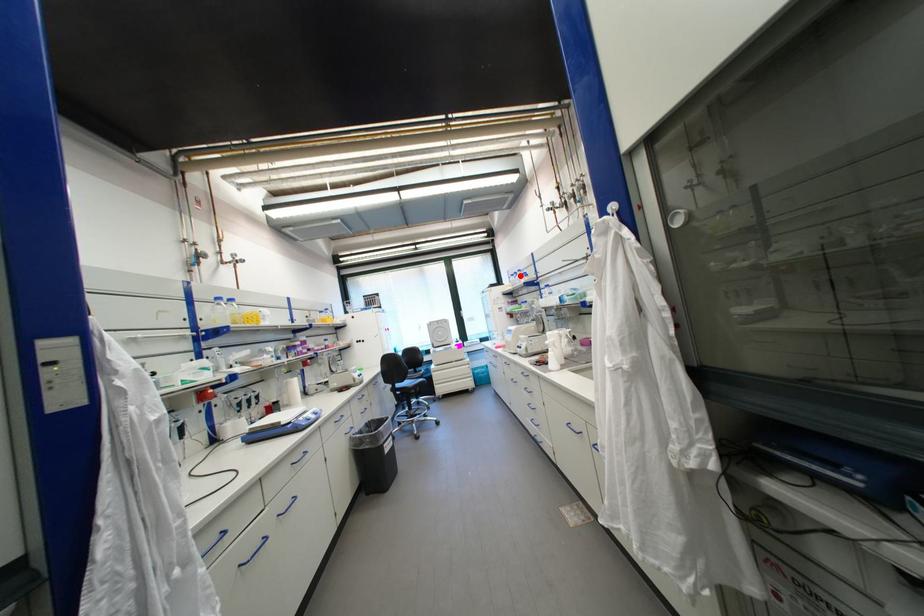
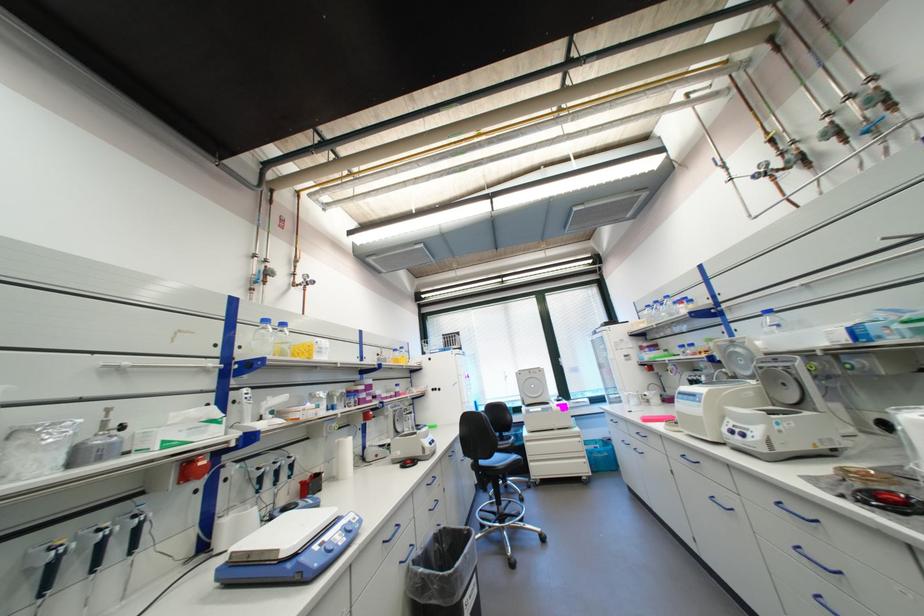
Question: I am providing you with two images of the same scene from different viewpoints. A red point is marked on the first image. Can you still see the location of the red point in image 2?

Choices:
 (A) Yes
 (B) No

Answer: (A)